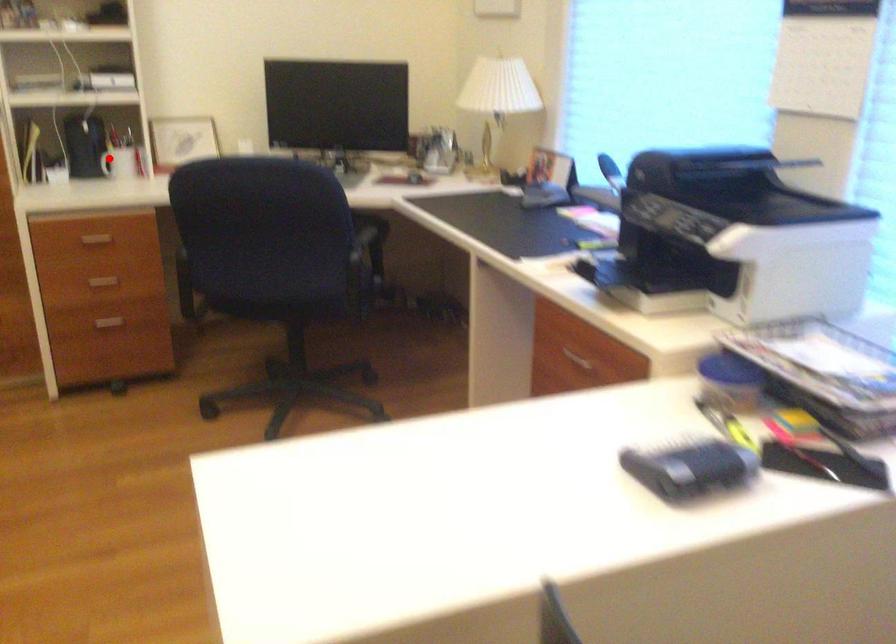
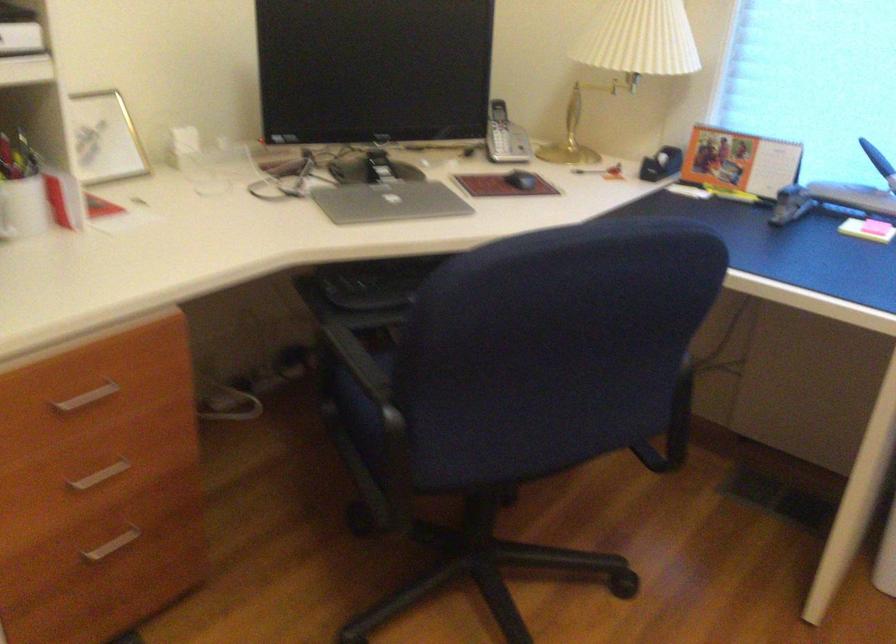
Locate, in the second image, the point that corresponds to the highlighted location in the first image.

(23, 207)